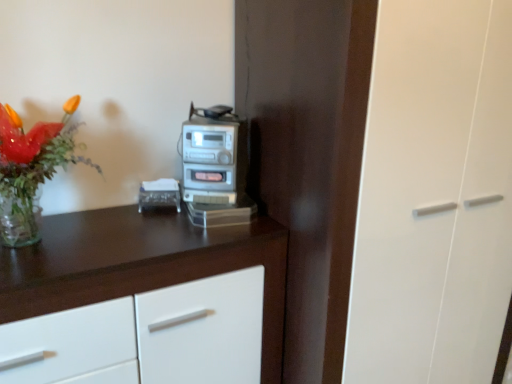
The width and height of the screenshot is (512, 384). What are the coordinates of `blank space situated above silver metallic stereo at center (from a real-world perspective)` in the screenshot? It's located at (211, 117).